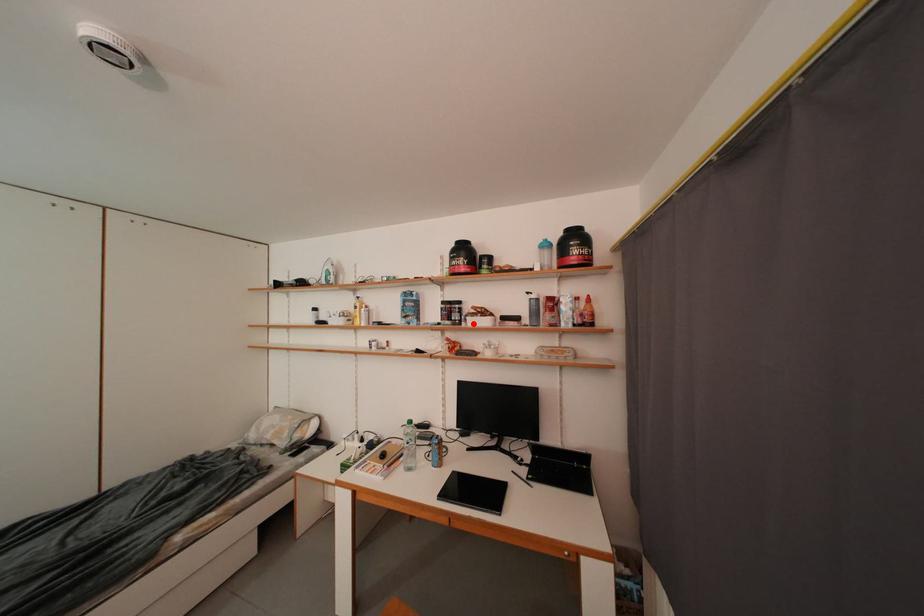
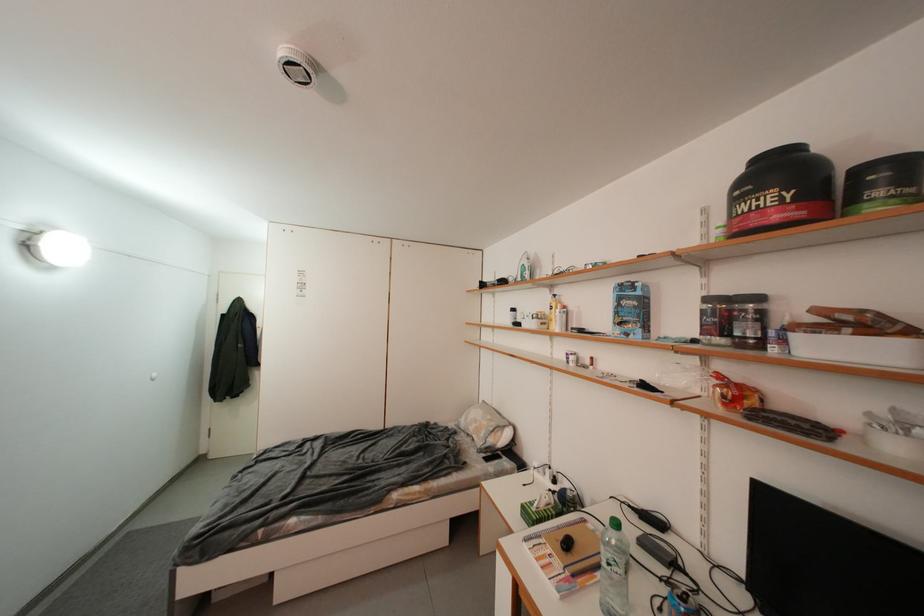
Locate, in the second image, the point that corresponds to the highlighted location in the first image.

(792, 345)